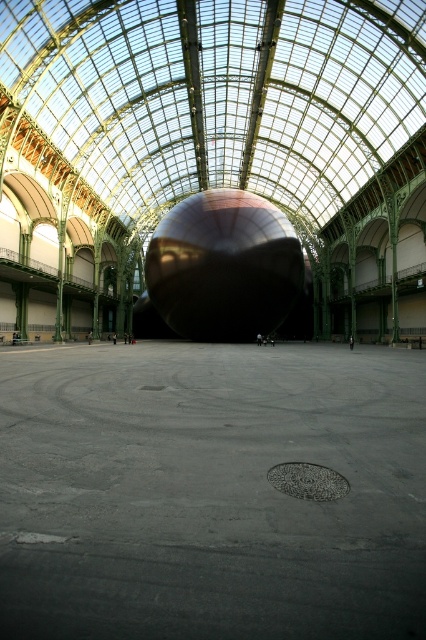
Is metallic sphere at center above shiny metallic sphere at center?

Incorrect, metallic sphere at center is not positioned above shiny metallic sphere at center.

Between point (380, 419) and point (264, 272), which one is positioned in front?

Point (380, 419) is in front.

Does point (8, 600) lie behind point (218, 241)?

No, it is not.

Find the location of a particular element. Image resolution: width=426 pixels, height=640 pixels. metallic sphere at center is located at coordinates (210, 492).